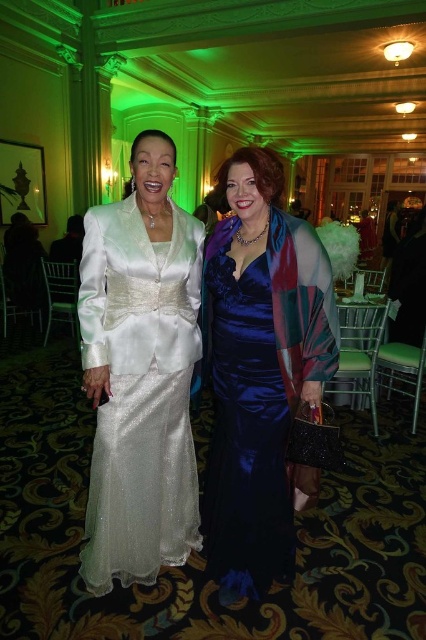
Question: Is satin white suit at center bigger than satin blue dress at center?

Choices:
 (A) no
 (B) yes

Answer: (A)

Question: Which point appears farthest from the camera in this image?

Choices:
 (A) (221, 493)
 (B) (108, 310)

Answer: (A)

Question: Can you confirm if satin white suit at center is wider than satin blue dress at center?

Choices:
 (A) no
 (B) yes

Answer: (B)

Question: Does satin white suit at center have a lesser width compared to satin blue dress at center?

Choices:
 (A) no
 (B) yes

Answer: (A)

Question: Which of the following is the farthest from the observer?

Choices:
 (A) satin white suit at center
 (B) satin blue dress at center

Answer: (A)

Question: Which point is closer to the camera taking this photo?

Choices:
 (A) (131, 396)
 (B) (216, 310)

Answer: (A)